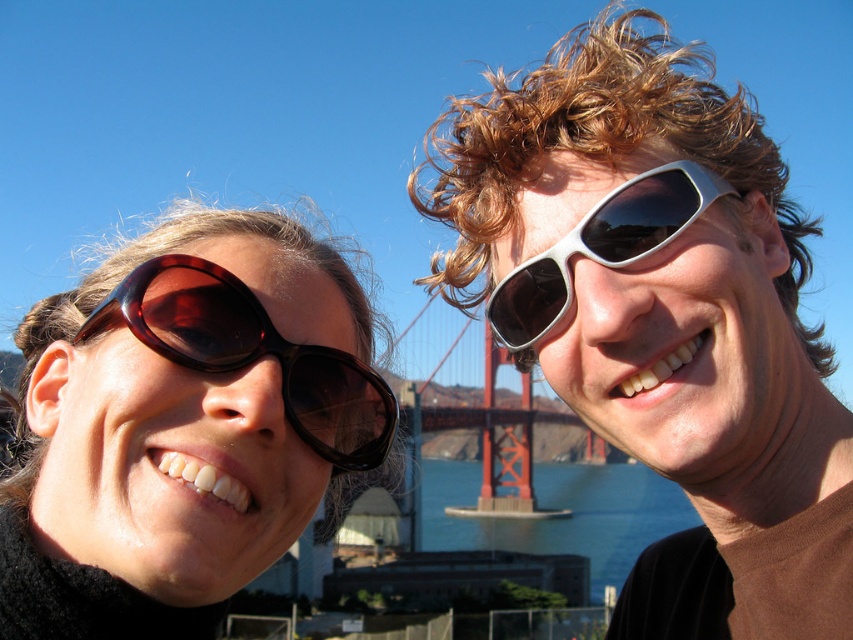
What are the coordinates of `silver reflective sunglasses at upper right` in the screenshot? It's located at click(x=669, y=324).

Who is lower down, silver reflective sunglasses at upper right or blue water at center?

blue water at center is lower down.

Is point (456, 125) farther from camera compared to point (618, 534)?

No, it is in front of (618, 534).

The width and height of the screenshot is (853, 640). Find the location of `silver reflective sunglasses at upper right`. silver reflective sunglasses at upper right is located at coordinates tap(669, 324).

Is the position of tortoiseshell sunglasses at upper left less distant than that of blue water at center?

Yes, it is in front of blue water at center.

Which is more to the left, tortoiseshell sunglasses at upper left or blue water at center?

tortoiseshell sunglasses at upper left

Is point (167, 470) in front of point (619, 509)?

Yes.

Find the location of `tortoiseshell sunglasses at upper left`. tortoiseshell sunglasses at upper left is located at coordinates (183, 426).

Who is more distant from viewer, (244, 346) or (686, 177)?

Positioned behind is point (686, 177).

Does brown glossy sunglasses at left have a smaller size compared to metallic silver sunglasses at upper right?

Incorrect, brown glossy sunglasses at left is not smaller in size than metallic silver sunglasses at upper right.

Is point (183, 324) behind point (628, 228)?

No, it is not.

The image size is (853, 640). In order to click on brown glossy sunglasses at left in this screenshot , I will do `click(253, 353)`.